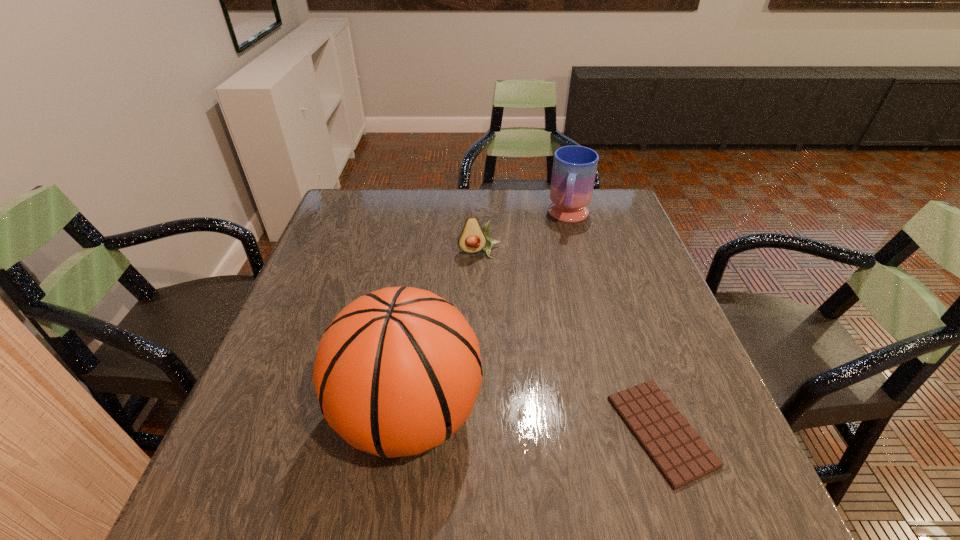
In order to click on basketball in this screenshot , I will do `click(397, 372)`.

Where is `chocolate bar`? chocolate bar is located at coordinates (680, 454).

Find the location of `avocado`. avocado is located at coordinates (473, 238).

You are a GUI agent. You are given a task and a screenshot of the screen. Output one action in this format:
    pyautogui.click(x=<x>, y=<y>)
    Task: Click on the second farthest object
    This screenshot has width=960, height=540.
    Given the screenshot: What is the action you would take?
    pyautogui.click(x=473, y=238)

Find the location of `mug`. mug is located at coordinates (574, 170).

Identify the location of the farthest object. (574, 170).

Identify the location of vacant space located 0.070m on the left of the tallest object. (299, 415).

Where is `vacant region located 0.200m on the back of the chocolate bar`? vacant region located 0.200m on the back of the chocolate bar is located at coordinates (621, 312).

Where is `vacant space located on the seed side of the third tallest object`? vacant space located on the seed side of the third tallest object is located at coordinates (489, 292).

You are a GUI agent. You are given a task and a screenshot of the screen. Output one action in this format:
    pyautogui.click(x=<x>, y=<y>)
    Task: Click on the vacant point located on the seed side of the third tallest object
    This screenshot has width=960, height=540.
    Given the screenshot: What is the action you would take?
    pyautogui.click(x=505, y=370)